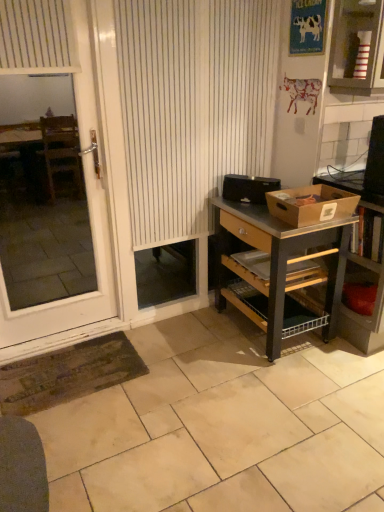
Question: Does black plastic toaster at center, the first box positioned from the back, lie behind white glossy screen door at left?

Choices:
 (A) yes
 (B) no

Answer: (A)

Question: From a real-world perspective, is black plastic toaster at center, the first box positioned from the back, located beneath white glossy screen door at left?

Choices:
 (A) no
 (B) yes

Answer: (B)

Question: Can you confirm if black plastic toaster at center, positioned as the second box in front-to-back order, is positioned to the left of white glossy screen door at left?

Choices:
 (A) yes
 (B) no

Answer: (B)

Question: Does black plastic toaster at center, positioned as the second box in front-to-back order, turn towards white glossy screen door at left?

Choices:
 (A) no
 (B) yes

Answer: (A)

Question: Is black plastic toaster at center, positioned as the second box in front-to-back order, taller than white glossy screen door at left?

Choices:
 (A) yes
 (B) no

Answer: (B)

Question: In terms of height, does wooden desk at right look taller or shorter compared to black plastic toaster at center, the first box positioned from the back?

Choices:
 (A) tall
 (B) short

Answer: (A)

Question: In the image, is wooden desk at right positioned in front of or behind black plastic toaster at center, positioned as the second box in front-to-back order?

Choices:
 (A) behind
 (B) front

Answer: (B)

Question: From the image's perspective, is wooden desk at right above or below black plastic toaster at center, the first box positioned from the back?

Choices:
 (A) below
 (B) above

Answer: (A)

Question: In the image, is wooden desk at right on the left side or the right side of black plastic toaster at center, the first box positioned from the back?

Choices:
 (A) right
 (B) left

Answer: (A)

Question: From the image's perspective, is brown cardboard box at right, placed as the 2th box when sorted from back to front, above or below wooden shelf at right?

Choices:
 (A) below
 (B) above

Answer: (B)

Question: In terms of height, does brown cardboard box at right, which is counted as the 1th box, starting from the front, look taller or shorter compared to wooden shelf at right?

Choices:
 (A) tall
 (B) short

Answer: (B)

Question: Is point (331, 202) positioned closer to the camera than point (357, 266)?

Choices:
 (A) closer
 (B) farther

Answer: (A)

Question: Considering their positions, is brown cardboard box at right, which is counted as the 1th box, starting from the front, located in front of or behind wooden shelf at right?

Choices:
 (A) behind
 (B) front

Answer: (B)

Question: In terms of width, does striped cardboard box at upper right look wider or thinner when compared to black plastic toaster at center, the first box positioned from the back?

Choices:
 (A) wide
 (B) thin

Answer: (A)

Question: From the image's perspective, is striped cardboard box at upper right positioned above or below black plastic toaster at center, positioned as the second box in front-to-back order?

Choices:
 (A) below
 (B) above

Answer: (B)